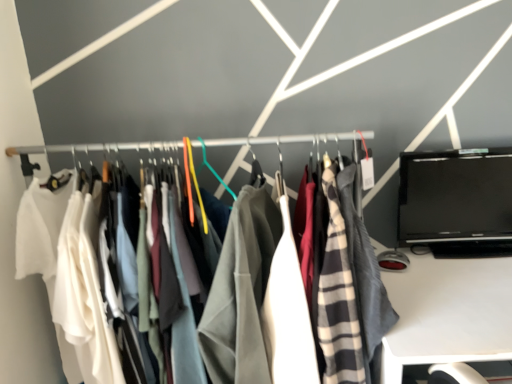
The width and height of the screenshot is (512, 384). What do you see at coordinates (457, 202) in the screenshot?
I see `black glossy laptop at right` at bounding box center [457, 202].

The height and width of the screenshot is (384, 512). What do you see at coordinates (448, 313) in the screenshot?
I see `white plastic desk at lower right` at bounding box center [448, 313].

Find the location of a particular element. This screenshot has height=384, width=512. matte fabric clothes at center is located at coordinates (290, 141).

Relative to white plastic desk at lower right, is black glossy laptop at right in front or behind?

Visually, black glossy laptop at right is located behind white plastic desk at lower right.

Considering the relative sizes of black glossy laptop at right and white plastic desk at lower right in the image provided, is black glossy laptop at right thinner than white plastic desk at lower right?

Indeed, black glossy laptop at right has a lesser width compared to white plastic desk at lower right.

Is black glossy laptop at right aimed at white plastic desk at lower right?

No, black glossy laptop at right is not aimed at white plastic desk at lower right.

Is black glossy laptop at right to the left or to the right of white plastic desk at lower right in the image?

In the image, black glossy laptop at right appears on the right side of white plastic desk at lower right.

Considering the points (222, 141) and (459, 233), which point is in front, point (222, 141) or point (459, 233)?

Point (222, 141)

Is matte fabric clothes at center thinner than black glossy laptop at right?

In fact, matte fabric clothes at center might be wider than black glossy laptop at right.

In order to click on closet in front of the black glossy laptop at right in this screenshot , I will do `click(290, 141)`.

Considering the relative sizes of matte fabric clothes at center and black glossy laptop at right in the image provided, is matte fabric clothes at center taller than black glossy laptop at right?

Yes.

Is white plastic desk at lower right positioned far away from black glossy laptop at right?

white plastic desk at lower right is actually quite close to black glossy laptop at right.

Is white plastic desk at lower right smaller than black glossy laptop at right?

No, white plastic desk at lower right is not smaller than black glossy laptop at right.

Considering the relative sizes of white plastic desk at lower right and black glossy laptop at right in the image provided, is white plastic desk at lower right taller than black glossy laptop at right?

Yes.

Which of these two, black glossy laptop at right or matte fabric clothes at center, is thinner?

Thinner between the two is black glossy laptop at right.

Based on the photo, is black glossy laptop at right aimed at matte fabric clothes at center?

No, black glossy laptop at right is not aimed at matte fabric clothes at center.

Does point (499, 345) appear closer or farther from the camera than point (87, 148)?

Point (499, 345) is closer to the camera than point (87, 148).

Is white plastic desk at lower right next to matte fabric clothes at center and touching it?

They are not placed beside each other.

The image size is (512, 384). In order to click on closet that is above the white plastic desk at lower right (from a real-world perspective) in this screenshot , I will do `click(290, 141)`.

Between white plastic desk at lower right and matte fabric clothes at center, which one is positioned behind?

matte fabric clothes at center.

Based on the photo, from a real-world perspective, is matte fabric clothes at center located higher than white plastic desk at lower right?

Indeed, from a real-world perspective, matte fabric clothes at center stands above white plastic desk at lower right.

Is matte fabric clothes at center turned away from white plastic desk at lower right?

No, matte fabric clothes at center is not facing the opposite direction of white plastic desk at lower right.

From the image's perspective, would you say matte fabric clothes at center is shown under white plastic desk at lower right?

No, from the image's perspective, matte fabric clothes at center is not beneath white plastic desk at lower right.

Which point is more distant from viewer, (44, 146) or (480, 294)?

The point (44, 146) is behind.

Find the location of a particular element. Image resolution: width=512 pixels, height=384 pixels. furniture below the black glossy laptop at right (from the image's perspective) is located at coordinates (448, 313).

Image resolution: width=512 pixels, height=384 pixels. I want to click on closet on the left of black glossy laptop at right, so (x=290, y=141).

Considering their positions, is black glossy laptop at right positioned closer to matte fabric clothes at center than white plastic desk at lower right?

The object closer to matte fabric clothes at center is black glossy laptop at right.

Looking at the image, which one is located closer to white plastic desk at lower right, black glossy laptop at right or matte fabric clothes at center?

black glossy laptop at right lies closer to white plastic desk at lower right than the other object.

From the image, which object appears to be nearer to black glossy laptop at right, matte fabric clothes at center or white plastic desk at lower right?

white plastic desk at lower right is closer to black glossy laptop at right.

Based on their spatial positions, is white plastic desk at lower right or black glossy laptop at right closer to matte fabric clothes at center?

black glossy laptop at right lies closer to matte fabric clothes at center than the other object.

Which object lies nearer to the anchor point black glossy laptop at right, white plastic desk at lower right or matte fabric clothes at center?

The object closer to black glossy laptop at right is white plastic desk at lower right.

When comparing their distances from white plastic desk at lower right, does matte fabric clothes at center or black glossy laptop at right seem closer?

The object closer to white plastic desk at lower right is black glossy laptop at right.

Where is `furniture between matte fabric clothes at center and black glossy laptop at right in the horizontal direction`? The height and width of the screenshot is (384, 512). furniture between matte fabric clothes at center and black glossy laptop at right in the horizontal direction is located at coordinates (448, 313).